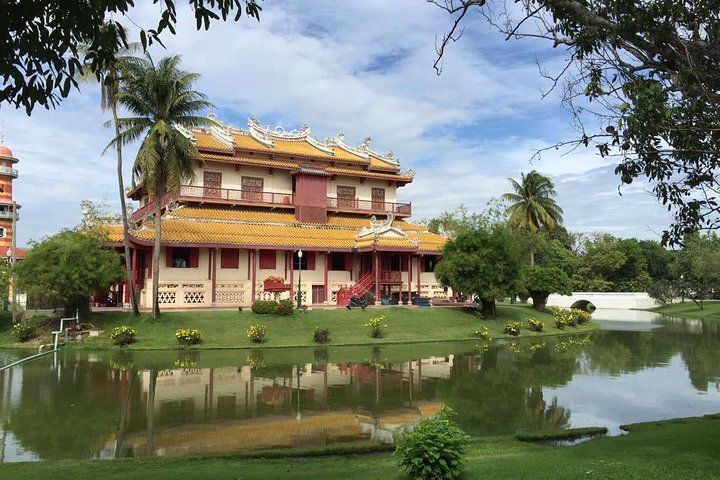
You are a GUI agent. You are given a task and a screenshot of the screen. Output one action in this format:
    pyautogui.click(x=<x>, y=<y>)
    Task: Click on the lower windows
    This screenshot has width=720, height=480.
    Given the screenshot: What is the action you would take?
    [x=184, y=260], [x=233, y=264], [x=271, y=262], [x=312, y=264], [x=333, y=265], [x=396, y=265]